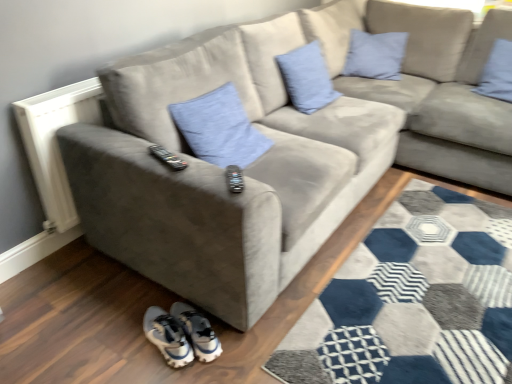
Locate an element on the screen. blue fabric pillow at center, positioned as the fourth pillow in right-to-left order is located at coordinates (219, 128).

Describe the element at coordinates (181, 334) in the screenshot. I see `white synthetic sneakers at lower center` at that location.

What is the approximate width of blue linen pillow at upper center, which ranks as the second pillow in left-to-right order?

The width of blue linen pillow at upper center, which ranks as the second pillow in left-to-right order, is 11.59 inches.

The width and height of the screenshot is (512, 384). Find the location of `light blue fabric pillow at upper right, the third pillow in the left-to-right sequence`. light blue fabric pillow at upper right, the third pillow in the left-to-right sequence is located at coordinates (375, 55).

Find the location of a particular element. This screenshot has width=512, height=384. blue fabric pillow at center, the 1th pillow from the left is located at coordinates (219, 128).

Considering the points (494, 51) and (57, 152), which point is behind, point (494, 51) or point (57, 152)?

The point (494, 51) is more distant.

How different are the orientations of blue fabric pillow at upper right, which is counted as the first pillow, starting from the right, and white textured radiator at left in degrees?

There is a 95.4-degree angle between the facing directions of blue fabric pillow at upper right, which is counted as the first pillow, starting from the right, and white textured radiator at left.

From a real-world perspective, which is physically below, blue fabric pillow at upper right, the 4th pillow when ordered from left to right, or white textured radiator at left?

white textured radiator at left.

Are light blue fabric pillow at upper right, which is the second pillow from right to left, and white synthetic sneakers at lower center far apart?

Yes.

Which is in front, point (397, 46) or point (178, 355)?

The point (178, 355) is in front.

You are a GUI agent. You are given a task and a screenshot of the screen. Output one action in this format:
    pyautogui.click(x=<x>, y=<y>)
    Task: Click on the footwear that appears on the left of light blue fabric pillow at upper right, which is the second pillow from right to left
    This screenshot has height=384, width=512.
    Given the screenshot: What is the action you would take?
    [181, 334]

Between point (185, 335) and point (499, 66), which one is positioned behind?

Positioned behind is point (499, 66).

Does white synthetic sneakers at lower center have a lesser height compared to blue fabric pillow at upper right, the 4th pillow when ordered from left to right?

Yes.

Which object is positioned more to the left, white synthetic sneakers at lower center or blue fabric pillow at upper right, the 4th pillow when ordered from left to right?

white synthetic sneakers at lower center.

Based on their sizes in the image, would you say light blue fabric pillow at upper right, which is the second pillow from right to left, is bigger or smaller than white textured radiator at left?

In the image, light blue fabric pillow at upper right, which is the second pillow from right to left, appears to be larger than white textured radiator at left.

Could you tell me if light blue fabric pillow at upper right, which is the second pillow from right to left, is facing white textured radiator at left?

No.

Where is `the 3rd pillow above the white textured radiator at left (from a real-world perspective)`? the 3rd pillow above the white textured radiator at left (from a real-world perspective) is located at coordinates (375, 55).

Which object is thinner, light blue fabric pillow at upper right, the third pillow in the left-to-right sequence, or white textured radiator at left?

white textured radiator at left.

Is light blue fabric pillow at upper right, the third pillow in the left-to-right sequence, oriented towards blue fabric pillow at center, positioned as the fourth pillow in right-to-left order?

Yes, light blue fabric pillow at upper right, the third pillow in the left-to-right sequence, faces towards blue fabric pillow at center, positioned as the fourth pillow in right-to-left order.

Considering the sizes of objects light blue fabric pillow at upper right, which is the second pillow from right to left, and blue fabric pillow at center, positioned as the fourth pillow in right-to-left order, in the image provided, who is taller, light blue fabric pillow at upper right, which is the second pillow from right to left, or blue fabric pillow at center, positioned as the fourth pillow in right-to-left order,?

light blue fabric pillow at upper right, which is the second pillow from right to left, is taller.

From the image's perspective, between light blue fabric pillow at upper right, the third pillow in the left-to-right sequence, and blue fabric pillow at center, positioned as the fourth pillow in right-to-left order, which one is located above?

light blue fabric pillow at upper right, the third pillow in the left-to-right sequence.

Based on their sizes in the image, would you say blue linen pillow at upper center, which ranks as the second pillow in left-to-right order, is bigger or smaller than white synthetic sneakers at lower center?

In the image, blue linen pillow at upper center, which ranks as the second pillow in left-to-right order, appears to be larger than white synthetic sneakers at lower center.

Find the location of a particular element. This screenshot has height=384, width=512. the 2nd pillow above the white synthetic sneakers at lower center (from the image's perspective) is located at coordinates (307, 78).

Considering the points (321, 72) and (192, 355), which point is behind, point (321, 72) or point (192, 355)?

Point (321, 72)

Is blue linen pillow at upper center, placed as the 3th pillow when sorted from right to left, facing away from white synthetic sneakers at lower center?

blue linen pillow at upper center, placed as the 3th pillow when sorted from right to left, is not turned away from white synthetic sneakers at lower center.

Which object is wider, white synthetic sneakers at lower center or blue fabric pillow at center, the 1th pillow from the left?

blue fabric pillow at center, the 1th pillow from the left, is wider.

Looking at this image, is white synthetic sneakers at lower center aimed at blue fabric pillow at center, positioned as the fourth pillow in right-to-left order?

No, white synthetic sneakers at lower center is not facing towards blue fabric pillow at center, positioned as the fourth pillow in right-to-left order.

Considering the relative positions of white synthetic sneakers at lower center and blue fabric pillow at center, the 1th pillow from the left, in the image provided, is white synthetic sneakers at lower center to the left of blue fabric pillow at center, the 1th pillow from the left, from the viewer's perspective?

Indeed, white synthetic sneakers at lower center is positioned on the left side of blue fabric pillow at center, the 1th pillow from the left.

At what (x,y) coordinates should I click in order to perform the action: click on radiator below the blue fabric pillow at upper right, the 4th pillow when ordered from left to right (from the image's perspective). Please return your answer as a coordinate pair (x, y). Looking at the image, I should click on (56, 143).

From the image's perspective, count 4th pillows upward from the white synthetic sneakers at lower center and point to it. Please provide its 2D coordinates.

[(375, 55)]

Which object lies further to the anchor point blue fabric pillow at upper right, the 4th pillow when ordered from left to right, white synthetic sneakers at lower center or blue linen pillow at upper center, which ranks as the second pillow in left-to-right order?

Based on the image, white synthetic sneakers at lower center appears to be further to blue fabric pillow at upper right, the 4th pillow when ordered from left to right.

Considering their positions, is light blue fabric pillow at upper right, the third pillow in the left-to-right sequence, positioned further to blue fabric pillow at upper right, the 4th pillow when ordered from left to right, than blue fabric pillow at center, the 1th pillow from the left?

Among the two, blue fabric pillow at center, the 1th pillow from the left, is located further to blue fabric pillow at upper right, the 4th pillow when ordered from left to right.

Which object lies nearer to the anchor point blue fabric pillow at upper right, the 4th pillow when ordered from left to right, white synthetic sneakers at lower center or blue fabric pillow at center, the 1th pillow from the left?

blue fabric pillow at center, the 1th pillow from the left.

Consider the image. Which object lies nearer to the anchor point light blue fabric pillow at upper right, the third pillow in the left-to-right sequence, white textured radiator at left or blue fabric pillow at upper right, the 4th pillow when ordered from left to right?

blue fabric pillow at upper right, the 4th pillow when ordered from left to right, is positioned closer to the anchor light blue fabric pillow at upper right, the third pillow in the left-to-right sequence.

Estimate the real-world distances between objects in this image. Which object is closer to blue fabric pillow at center, positioned as the fourth pillow in right-to-left order, blue fabric pillow at upper right, which is counted as the first pillow, starting from the right, or light blue fabric pillow at upper right, which is the second pillow from right to left?

The object closer to blue fabric pillow at center, positioned as the fourth pillow in right-to-left order, is light blue fabric pillow at upper right, which is the second pillow from right to left.

From the image, which object appears to be nearer to blue linen pillow at upper center, placed as the 3th pillow when sorted from right to left, light blue fabric pillow at upper right, which is the second pillow from right to left, or white textured radiator at left?

light blue fabric pillow at upper right, which is the second pillow from right to left, is positioned closer to the anchor blue linen pillow at upper center, placed as the 3th pillow when sorted from right to left.

Looking at the image, which one is located closer to white synthetic sneakers at lower center, white textured radiator at left or light blue fabric pillow at upper right, which is the second pillow from right to left?

white textured radiator at left is closer to white synthetic sneakers at lower center.

In the scene shown: Estimate the real-world distances between objects in this image. Which object is further from white textured radiator at left, blue linen pillow at upper center, placed as the 3th pillow when sorted from right to left, or white synthetic sneakers at lower center?

blue linen pillow at upper center, placed as the 3th pillow when sorted from right to left, is positioned further to the anchor white textured radiator at left.

Where is `pillow that lies between blue linen pillow at upper center, placed as the 3th pillow when sorted from right to left, and white synthetic sneakers at lower center from top to bottom`? Image resolution: width=512 pixels, height=384 pixels. pillow that lies between blue linen pillow at upper center, placed as the 3th pillow when sorted from right to left, and white synthetic sneakers at lower center from top to bottom is located at coordinates (219, 128).

You are a GUI agent. You are given a task and a screenshot of the screen. Output one action in this format:
    pyautogui.click(x=<x>, y=<y>)
    Task: Click on the pillow situated between white textured radiator at left and blue linen pillow at upper center, which ranks as the second pillow in left-to-right order, from left to right
    This screenshot has height=384, width=512.
    Given the screenshot: What is the action you would take?
    pyautogui.click(x=219, y=128)

Where is `footwear between white textured radiator at left and blue fabric pillow at upper right, the 4th pillow when ordered from left to right`? The width and height of the screenshot is (512, 384). footwear between white textured radiator at left and blue fabric pillow at upper right, the 4th pillow when ordered from left to right is located at coordinates (181, 334).

Find the location of a particular element. The width and height of the screenshot is (512, 384). radiator between blue linen pillow at upper center, which ranks as the second pillow in left-to-right order, and white synthetic sneakers at lower center vertically is located at coordinates (56, 143).